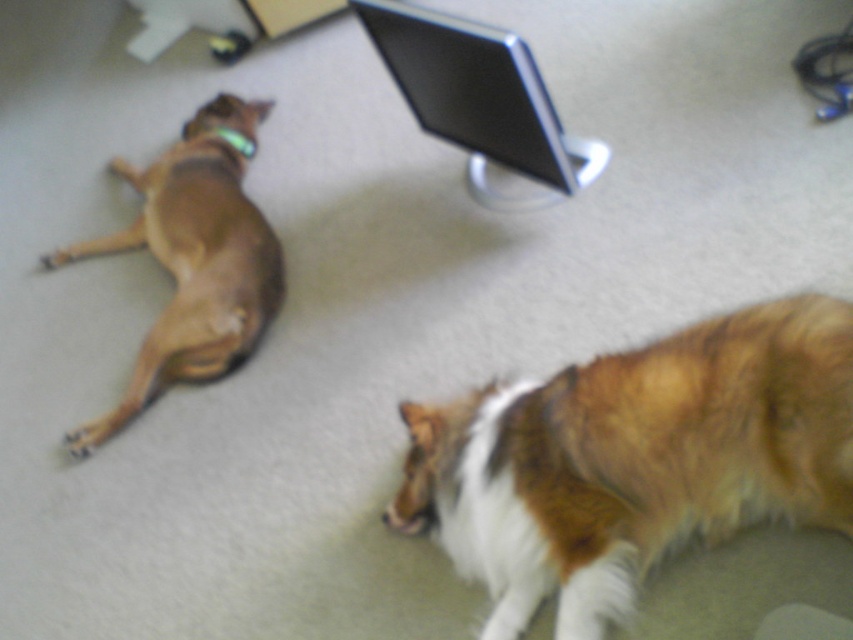
Is brown matte dog at left wider than black glossy monitor at upper center?

Correct, the width of brown matte dog at left exceeds that of black glossy monitor at upper center.

Which is above, brown matte dog at left or black glossy monitor at upper center?

black glossy monitor at upper center is higher up.

Which is behind, point (270, 310) or point (355, 1)?

The point (270, 310) is more distant.

This screenshot has width=853, height=640. What are the coordinates of `brown matte dog at left` in the screenshot? It's located at (193, 259).

Who is positioned more to the right, brown fluffy dog at lower right or black glossy monitor at upper center?

brown fluffy dog at lower right

You are a GUI agent. You are given a task and a screenshot of the screen. Output one action in this format:
    pyautogui.click(x=<x>, y=<y>)
    Task: Click on the brown fluffy dog at lower right
    This screenshot has width=853, height=640.
    Given the screenshot: What is the action you would take?
    pyautogui.click(x=634, y=460)

Where is `brown fluffy dog at lower right`? brown fluffy dog at lower right is located at coordinates (634, 460).

Can you confirm if brown fluffy dog at lower right is bigger than brown matte dog at left?

Incorrect, brown fluffy dog at lower right is not larger than brown matte dog at left.

Can you confirm if brown fluffy dog at lower right is wider than brown matte dog at left?

Correct, the width of brown fluffy dog at lower right exceeds that of brown matte dog at left.

Measure the distance between brown fluffy dog at lower right and camera.

brown fluffy dog at lower right and camera are 4.11 feet apart.

This screenshot has height=640, width=853. Find the location of `brown fluffy dog at lower right`. brown fluffy dog at lower right is located at coordinates (634, 460).